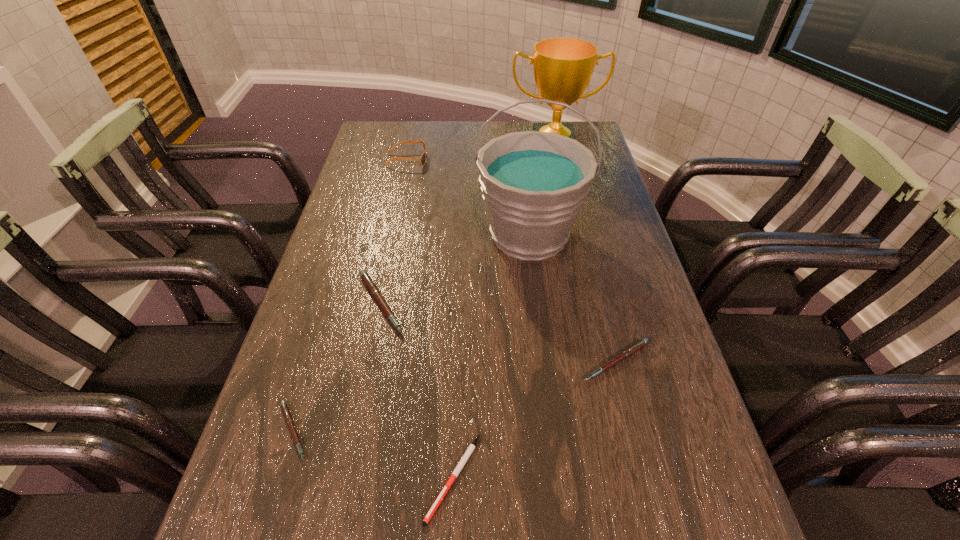
Where is `pen that can be found as the second closest to the rightmost pen`? This screenshot has height=540, width=960. pen that can be found as the second closest to the rightmost pen is located at coordinates (369, 283).

Locate an element on the screen. Image resolution: width=960 pixels, height=540 pixels. the second closest pen to the fifth tallest object is located at coordinates (369, 283).

Select which pink pen appears as the closest to the tallest pen. Please provide its 2D coordinates. Your answer should be formatted as a tuple, i.e. [(x, y)], where the tuple contains the x and y coordinates of a point satisfying the conditions above.

[(285, 409)]

Locate which pink pen is the third closest to the white pen. Please provide its 2D coordinates. Your answer should be formatted as a tuple, i.e. [(x, y)], where the tuple contains the x and y coordinates of a point satisfying the conditions above.

[(369, 283)]

Locate an element on the screen. This screenshot has width=960, height=540. vacant position in the image that satisfies the following two spatial constraints: 1. on the front-facing side of the award; 2. at the nib of the leftmost pen is located at coordinates (613, 431).